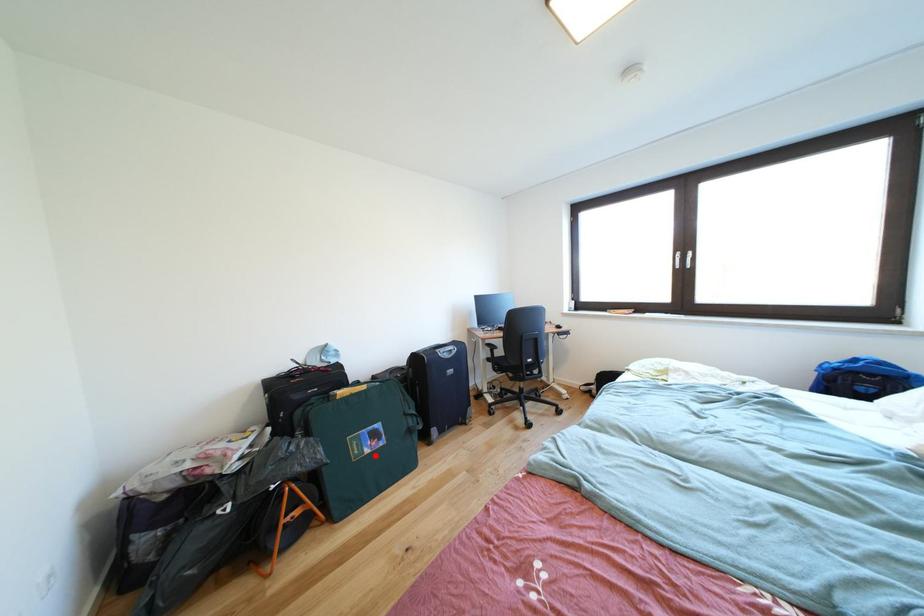
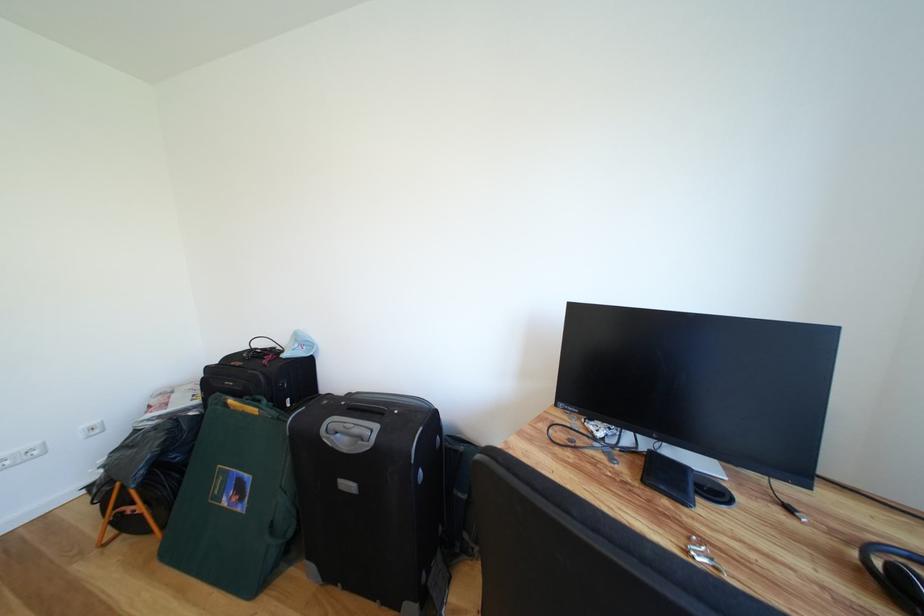
Question: A red point is marked in image1. In image2, is the corresponding 3D point closer to the camera or farther? Reply with the corresponding letter.

Choices:
 (A) The corresponding 3D point is closer.
 (B) The corresponding 3D point is farther.

Answer: (A)